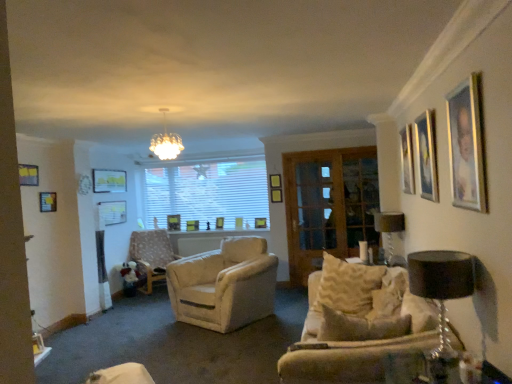
Question: From the image's perspective, is white glass chandelier at upper center located beneath wooden picture frame at center, the 7th picture frame viewed from the left?

Choices:
 (A) yes
 (B) no

Answer: (B)

Question: Considering the relative positions of white glass chandelier at upper center and wooden picture frame at center, marked as the tenth picture frame in a front-to-back arrangement, in the image provided, is white glass chandelier at upper center to the left of wooden picture frame at center, marked as the tenth picture frame in a front-to-back arrangement, from the viewer's perspective?

Choices:
 (A) yes
 (B) no

Answer: (A)

Question: Can you confirm if white glass chandelier at upper center is taller than wooden picture frame at center, the 7th picture frame viewed from the left?

Choices:
 (A) no
 (B) yes

Answer: (B)

Question: From a real-world perspective, is white glass chandelier at upper center on wooden picture frame at center, marked as the tenth picture frame in a front-to-back arrangement?

Choices:
 (A) yes
 (B) no

Answer: (A)

Question: Is white glass chandelier at upper center positioned with its back to wooden picture frame at center, the 7th picture frame viewed from the left?

Choices:
 (A) yes
 (B) no

Answer: (A)

Question: From a real-world perspective, is white glass chandelier at upper center physically located above or below wooden picture frame at center, the eighth picture frame when ordered from right to left?

Choices:
 (A) above
 (B) below

Answer: (A)

Question: In terms of size, does white glass chandelier at upper center appear bigger or smaller than wooden picture frame at center, the eighth picture frame when ordered from right to left?

Choices:
 (A) small
 (B) big

Answer: (B)

Question: Considering the relative positions of white glass chandelier at upper center and wooden picture frame at center, the eighth picture frame when ordered from right to left, in the image provided, is white glass chandelier at upper center to the left or to the right of wooden picture frame at center, the eighth picture frame when ordered from right to left,?

Choices:
 (A) left
 (B) right

Answer: (B)

Question: Considering the positions of white glass chandelier at upper center and wooden picture frame at center, the 1th picture frame viewed from the back, in the image, is white glass chandelier at upper center wider or thinner than wooden picture frame at center, the 1th picture frame viewed from the back,?

Choices:
 (A) wide
 (B) thin

Answer: (A)

Question: From a real-world perspective, relative to wooden picture frame at left, which is counted as the 11th picture frame, starting from the right, is matte black lampshade at right, the first lamp in the back-to-front sequence, vertically above or below?

Choices:
 (A) above
 (B) below

Answer: (B)

Question: Considering the positions of point (390, 246) and point (47, 206), is point (390, 246) closer or farther from the camera than point (47, 206)?

Choices:
 (A) farther
 (B) closer

Answer: (B)

Question: Looking at their shapes, would you say matte black lampshade at right, the 2th lamp viewed from the front, is wider or thinner than wooden picture frame at left, acting as the second picture frame starting from the left?

Choices:
 (A) wide
 (B) thin

Answer: (A)

Question: Is matte black lampshade at right, the 2th lamp viewed from the front, taller or shorter than wooden picture frame at left, which is the 5th picture frame in front-to-back order?

Choices:
 (A) tall
 (B) short

Answer: (A)

Question: Considering their positions, is wooden picture frame at center, the 6th picture frame viewed from the left, located in front of or behind matte gold picture frame at upper right, which appears as the 1th picture frame when viewed from the front?

Choices:
 (A) behind
 (B) front

Answer: (A)

Question: Based on their positions, is wooden picture frame at center, arranged as the 2th picture frame when viewed from the back, located to the left or right of matte gold picture frame at upper right, acting as the 12th picture frame starting from the back?

Choices:
 (A) right
 (B) left

Answer: (B)